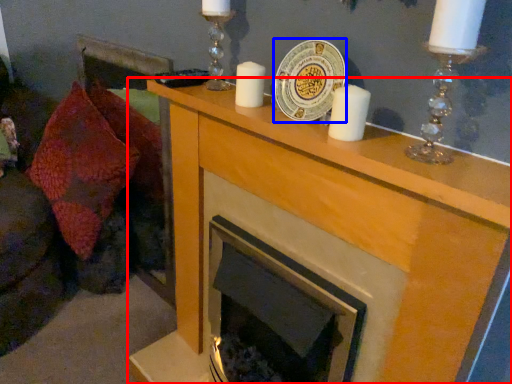
Question: Among these objects, which one is farthest to the camera, cabinetry (highlighted by a red box) or platter (highlighted by a blue box)?

Choices:
 (A) cabinetry
 (B) platter

Answer: (B)